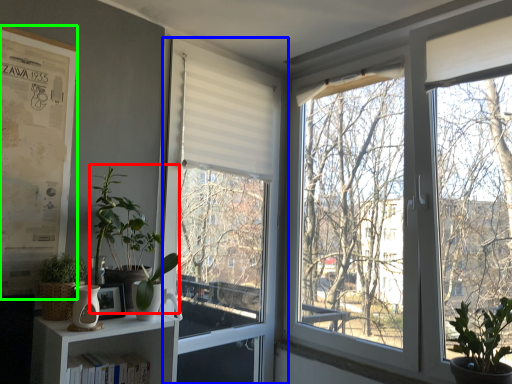
Question: Estimate the real-world distances between objects in this image. Which object is farther from vegetation (highlighted by a red box), window (highlighted by a blue box) or bulletin board (highlighted by a green box)?

Choices:
 (A) window
 (B) bulletin board

Answer: (A)